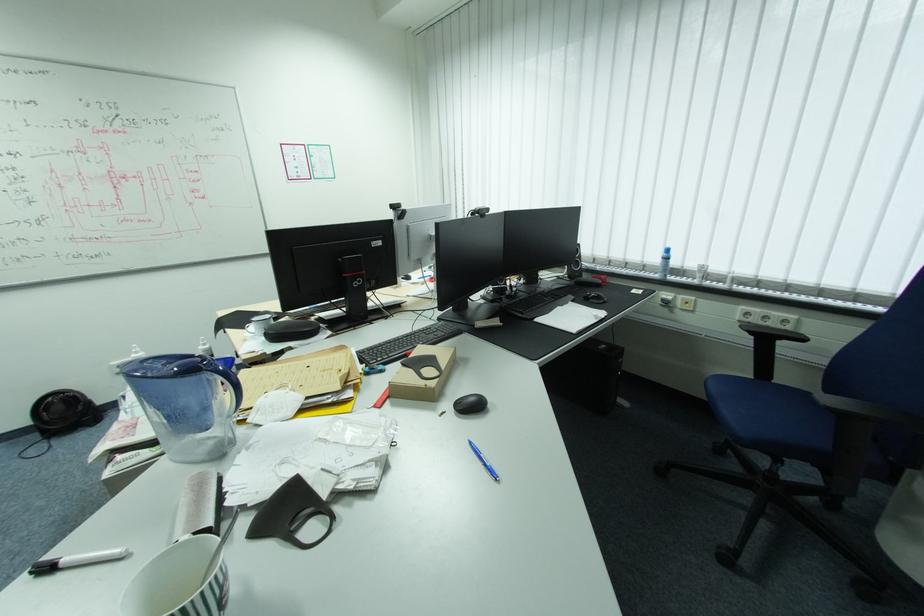
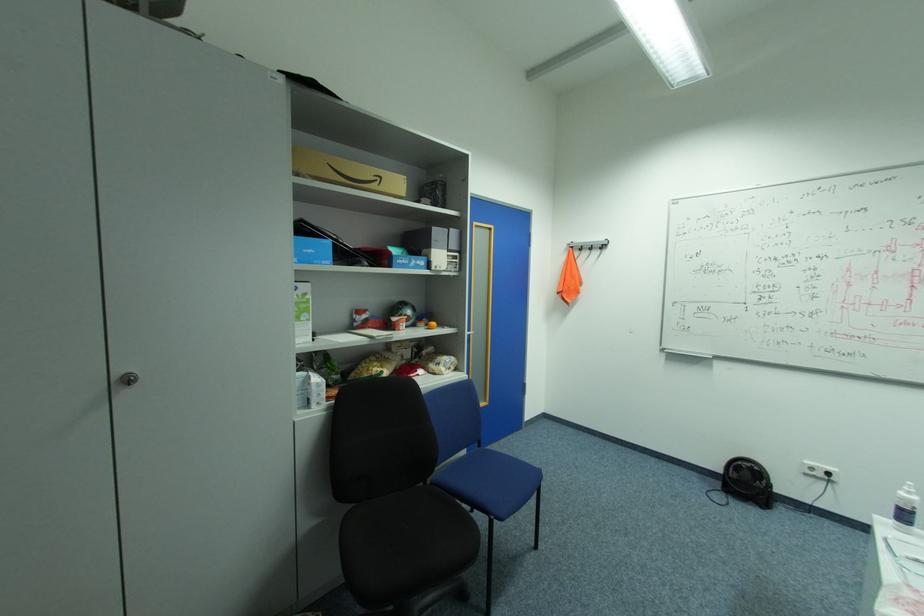
The point at (43, 435) is marked in the first image. Where is the corresponding point in the second image?

(724, 484)